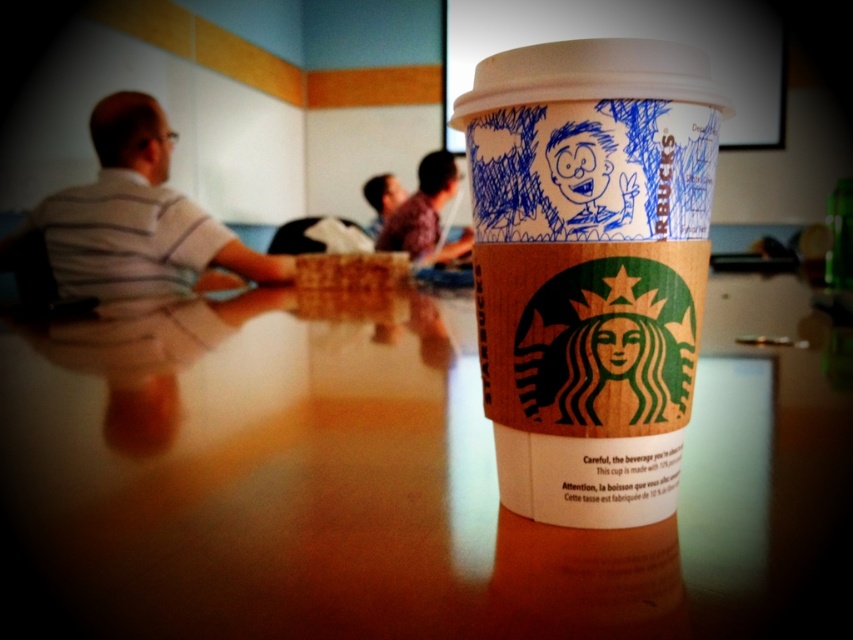
Question: Which of the following is the closest to the observer?

Choices:
 (A) brown paper cup at center
 (B) striped shirt at left
 (C) plaid shirt at center
 (D) wooden table at center

Answer: (D)

Question: Can you confirm if wooden table at center is positioned to the left of brown paper cup at center?

Choices:
 (A) yes
 (B) no

Answer: (B)

Question: Which of the following is the farthest from the observer?

Choices:
 (A) wooden table at center
 (B) plaid shirt at center
 (C) striped shirt at left

Answer: (B)

Question: Which of the following is the closest to the observer?

Choices:
 (A) (113, 134)
 (B) (128, 433)
 (C) (630, 220)

Answer: (C)

Question: From the image, what is the correct spatial relationship of brown paper cup at center in relation to striped shirt at left?

Choices:
 (A) left
 (B) right

Answer: (B)

Question: Where is brown paper cup at center located in relation to striped shirt at left in the image?

Choices:
 (A) above
 (B) below

Answer: (B)